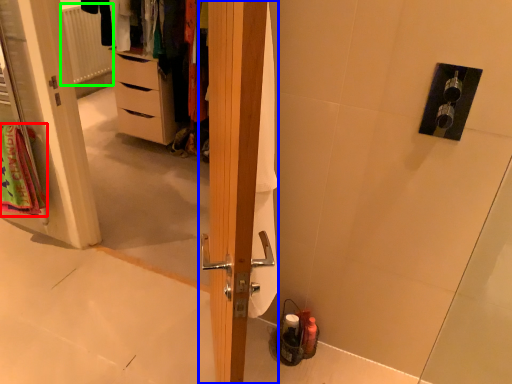
Question: Considering the real-world distances, which object is farthest from bath towel (highlighted by a red box)? door (highlighted by a blue box) or radiator (highlighted by a green box)?

Choices:
 (A) door
 (B) radiator

Answer: (B)